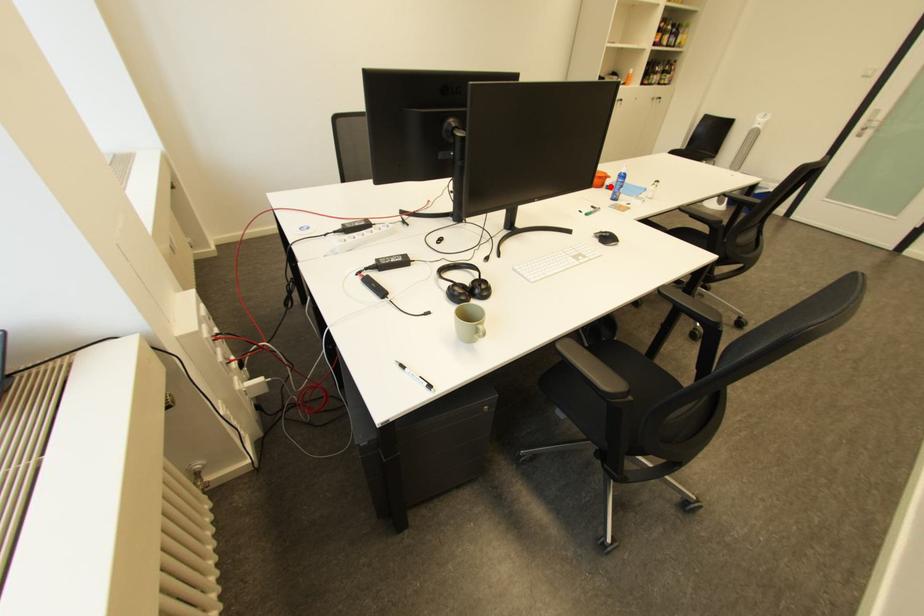
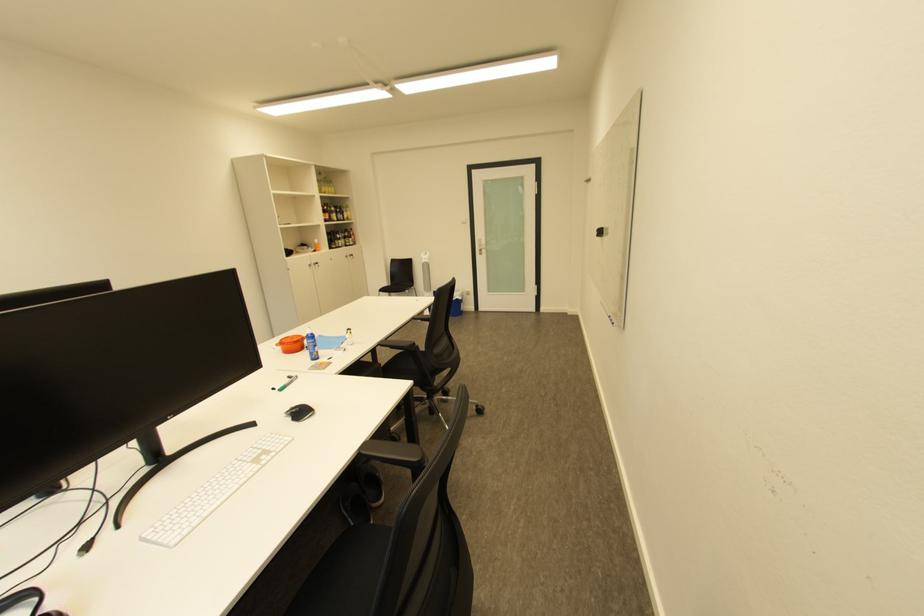
Find the pixel in the second image that matches the highlighted location in the first image.

(311, 350)